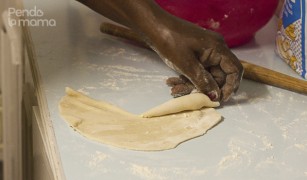
Image resolution: width=307 pixels, height=180 pixels. I want to click on mixing bowl, so click(x=215, y=8).